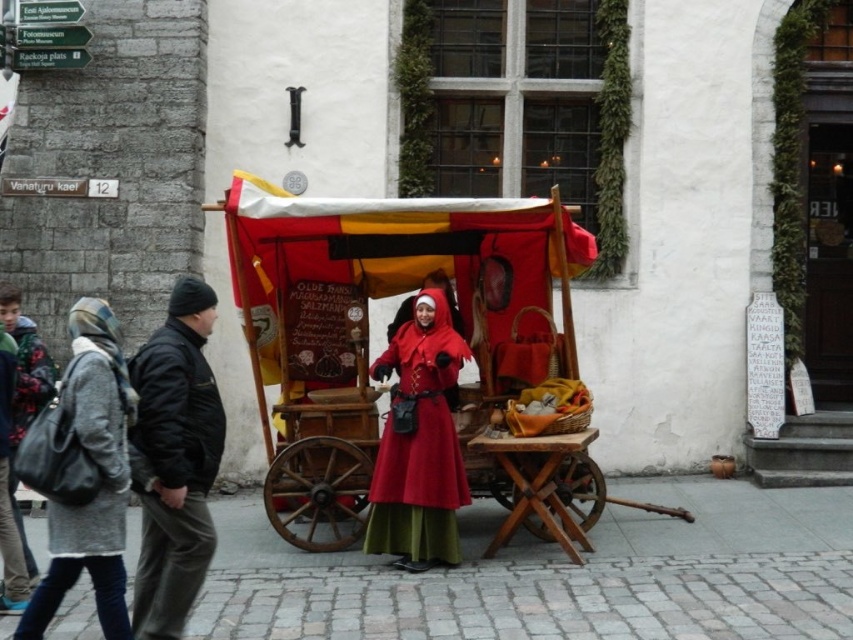
Is point (293, 243) positioned in front of point (62, 477)?

No, (293, 243) is behind (62, 477).

I want to click on red fabric cart at center, so click(436, 317).

Is cobblestone pavement at center taller than matte red coat at center?

No, cobblestone pavement at center is not taller than matte red coat at center.

Between point (289, 625) and point (456, 556), which one is positioned behind?

Point (456, 556)

Does point (235, 586) come behind point (402, 566)?

No, it is not.

Find the location of a particular element. The image size is (853, 640). cobblestone pavement at center is located at coordinates (558, 577).

You are a GUI agent. You are given a task and a screenshot of the screen. Output one action in this format:
    pyautogui.click(x=<x>, y=<y>)
    Task: Click on the black leather jacket at left
    
    Given the screenshot: What is the action you would take?
    pyautogui.click(x=175, y=460)

Image resolution: width=853 pixels, height=640 pixels. In order to click on black leather jacket at left in this screenshot , I will do `click(175, 460)`.